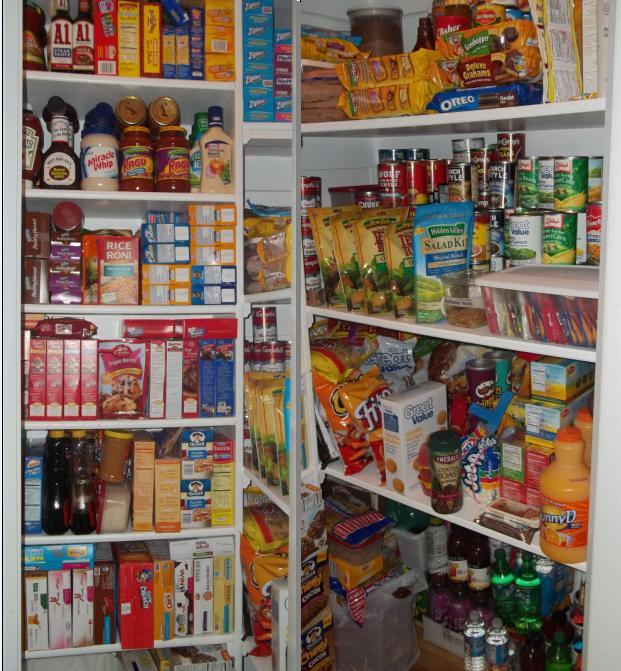
Find the location of a particular element. This screenshot has height=671, width=621. storage bags is located at coordinates (261, 9), (254, 30), (256, 54), (256, 72), (256, 98), (283, 105), (283, 85), (284, 60), (283, 35).